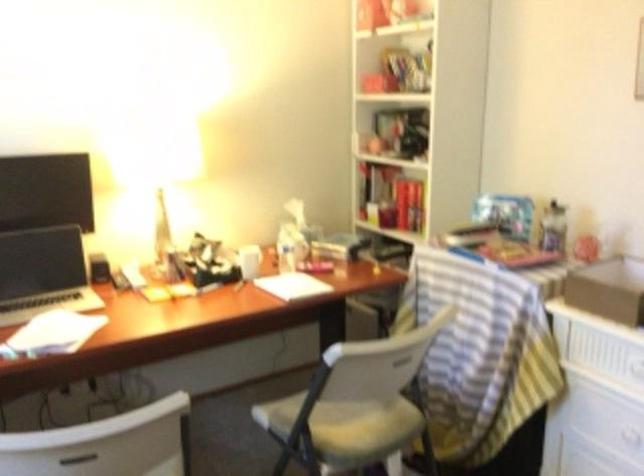
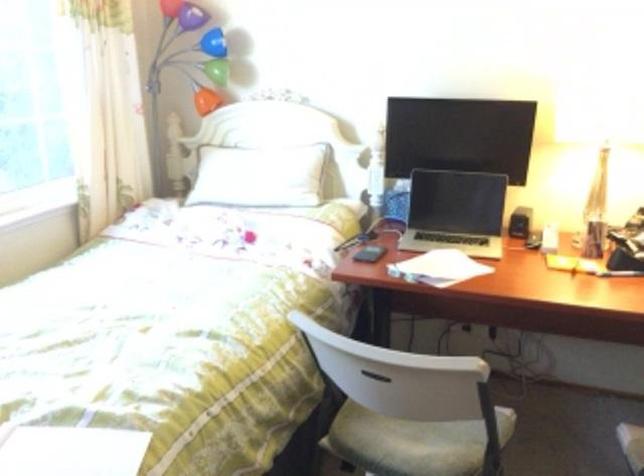
In the second image, find the point that corresponds to point 108,274 in the first image.

(518, 222)